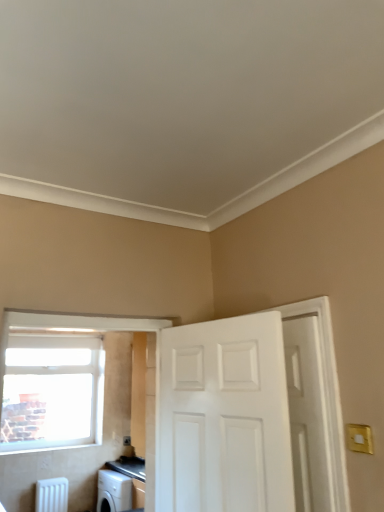
What do you see at coordinates (52, 391) in the screenshot?
I see `clear glass window at upper left` at bounding box center [52, 391].

Describe the element at coordinates (225, 417) in the screenshot. The height and width of the screenshot is (512, 384). I see `white glossy door at center, marked as the 1th door in a left-to-right arrangement` at that location.

Identify the location of white plastic radiator at lower left. The width and height of the screenshot is (384, 512). (52, 495).

Measure the distance between white plastic radiator at lower left and camera.

A distance of 4.09 meters exists between white plastic radiator at lower left and camera.

The image size is (384, 512). I want to click on clear glass window at upper left, so click(x=52, y=391).

What's the angular difference between white matte door at right, the 1th door in the right-to-left sequence, and white plastic radiator at lower left's facing directions?

There is a 93.2-degree angle between the facing directions of white matte door at right, the 1th door in the right-to-left sequence, and white plastic radiator at lower left.

In the scene shown: Between white matte door at right, the 1th door in the right-to-left sequence, and white plastic radiator at lower left, which one has smaller width?

With smaller width is white matte door at right, the 1th door in the right-to-left sequence.

Does point (301, 434) appear closer or farther from the camera than point (46, 480)?

Point (301, 434) appears to be closer to the viewer than point (46, 480).

Considering the relative positions of white glossy door at center, the second door in the right-to-left sequence, and white plastic radiator at lower left in the image provided, is white glossy door at center, the second door in the right-to-left sequence, behind white plastic radiator at lower left?

No, the depth of white glossy door at center, the second door in the right-to-left sequence, is less than that of white plastic radiator at lower left.

Considering the relative sizes of white glossy door at center, the second door in the right-to-left sequence, and white plastic radiator at lower left in the image provided, is white glossy door at center, the second door in the right-to-left sequence, bigger than white plastic radiator at lower left?

Yes.

How different are the orientations of white glossy door at center, the second door in the right-to-left sequence, and white plastic radiator at lower left in degrees?

The angular difference between white glossy door at center, the second door in the right-to-left sequence, and white plastic radiator at lower left is 83.7 degrees.

From the image's perspective, between white glossy door at center, marked as the 1th door in a left-to-right arrangement, and white plastic radiator at lower left, who is located below?

white plastic radiator at lower left is shown below in the image.

How far apart are white matte door at right, placed as the second door when sorted from left to right, and white glossy door at center, marked as the 1th door in a left-to-right arrangement?

white matte door at right, placed as the second door when sorted from left to right, is 11.56 inches from white glossy door at center, marked as the 1th door in a left-to-right arrangement.

From a real-world perspective, is white matte door at right, placed as the second door when sorted from left to right, over white glossy door at center, marked as the 1th door in a left-to-right arrangement?

Yes, from a real-world perspective, white matte door at right, placed as the second door when sorted from left to right, is over white glossy door at center, marked as the 1th door in a left-to-right arrangement

Is white matte door at right, the 1th door in the right-to-left sequence, in contact with white glossy door at center, marked as the 1th door in a left-to-right arrangement?

No, white matte door at right, the 1th door in the right-to-left sequence, is not touching white glossy door at center, marked as the 1th door in a left-to-right arrangement.

Based on their sizes in the image, would you say white matte door at right, the 1th door in the right-to-left sequence, is bigger or smaller than white glossy door at center, the second door in the right-to-left sequence?

In the image, white matte door at right, the 1th door in the right-to-left sequence, appears to be smaller than white glossy door at center, the second door in the right-to-left sequence.

Does white plastic radiator at lower left appear on the right side of white glossy door at center, the second door in the right-to-left sequence?

No, white plastic radiator at lower left is not to the right of white glossy door at center, the second door in the right-to-left sequence.

Identify the location of radiator on the left of white glossy door at center, marked as the 1th door in a left-to-right arrangement. (52, 495).

Does white plastic radiator at lower left have a lesser width compared to white glossy door at center, the second door in the right-to-left sequence?

No.

In terms of height, does clear glass window at upper left look taller or shorter compared to white plastic radiator at lower left?

clear glass window at upper left is taller than white plastic radiator at lower left.

Could you tell me if clear glass window at upper left is facing white plastic radiator at lower left?

No, clear glass window at upper left is not facing towards white plastic radiator at lower left.

You are a GUI agent. You are given a task and a screenshot of the screen. Output one action in this format:
    pyautogui.click(x=<x>, y=<y>)
    Task: Click on the radiator that is below the clear glass window at upper left (from the image's perspective)
    This screenshot has height=512, width=384.
    Given the screenshot: What is the action you would take?
    pyautogui.click(x=52, y=495)

Consider the image. Does white plastic radiator at lower left lie behind clear glass window at upper left?

No, white plastic radiator at lower left is closer to the camera.

Is white plastic radiator at lower left spatially inside clear glass window at upper left, or outside of it?

white plastic radiator at lower left is located beyond the bounds of clear glass window at upper left.

How many degrees apart are the facing directions of white plastic radiator at lower left and clear glass window at upper left?

The angle between the facing direction of white plastic radiator at lower left and the facing direction of clear glass window at upper left is 2.54 degrees.

In the scene shown: Considering the relative sizes of white plastic radiator at lower left and clear glass window at upper left in the image provided, is white plastic radiator at lower left taller than clear glass window at upper left?

In fact, white plastic radiator at lower left may be shorter than clear glass window at upper left.

Is white matte door at right, the 1th door in the right-to-left sequence, at the back of clear glass window at upper left?

No, clear glass window at upper left is not facing away from white matte door at right, the 1th door in the right-to-left sequence.

How far apart are clear glass window at upper left and white matte door at right, placed as the second door when sorted from left to right?

clear glass window at upper left and white matte door at right, placed as the second door when sorted from left to right, are 2.78 meters apart from each other.

Considering the sizes of clear glass window at upper left and white matte door at right, the 1th door in the right-to-left sequence, in the image, is clear glass window at upper left wider or thinner than white matte door at right, the 1th door in the right-to-left sequence,?

clear glass window at upper left is thinner than white matte door at right, the 1th door in the right-to-left sequence.

From the image's perspective, which one is positioned lower, clear glass window at upper left or white matte door at right, placed as the second door when sorted from left to right?

clear glass window at upper left is shown below in the image.

From the image's perspective, count 2nd doors upward from the white plastic radiator at lower left and point to it. Please provide its 2D coordinates.

[(307, 414)]

Locate an element on the screen. The height and width of the screenshot is (512, 384). the 2nd door in front of the white plastic radiator at lower left, counting from the anchor's position is located at coordinates (225, 417).

From the picture: Looking at the image, which one is located closer to clear glass window at upper left, white glossy door at center, the second door in the right-to-left sequence, or white plastic radiator at lower left?

white plastic radiator at lower left.

Looking at the image, which one is located further to white matte door at right, placed as the second door when sorted from left to right, white plastic radiator at lower left or white glossy door at center, marked as the 1th door in a left-to-right arrangement?

The object further to white matte door at right, placed as the second door when sorted from left to right, is white plastic radiator at lower left.

When comparing their distances from clear glass window at upper left, does white matte door at right, the 1th door in the right-to-left sequence, or white plastic radiator at lower left seem further?

The object further to clear glass window at upper left is white matte door at right, the 1th door in the right-to-left sequence.

Considering their positions, is clear glass window at upper left positioned closer to white glossy door at center, marked as the 1th door in a left-to-right arrangement, than white plastic radiator at lower left?

clear glass window at upper left is closer to white glossy door at center, marked as the 1th door in a left-to-right arrangement.

Consider the image. Which object lies nearer to the anchor point white matte door at right, the 1th door in the right-to-left sequence, white glossy door at center, the second door in the right-to-left sequence, or clear glass window at upper left?

white glossy door at center, the second door in the right-to-left sequence.

Which object lies further to the anchor point white matte door at right, the 1th door in the right-to-left sequence, white glossy door at center, the second door in the right-to-left sequence, or white plastic radiator at lower left?

white plastic radiator at lower left is positioned further to the anchor white matte door at right, the 1th door in the right-to-left sequence.

Considering their positions, is white matte door at right, the 1th door in the right-to-left sequence, positioned further to white plastic radiator at lower left than clear glass window at upper left?

white matte door at right, the 1th door in the right-to-left sequence.

Estimate the real-world distances between objects in this image. Which object is closer to white plastic radiator at lower left, white matte door at right, placed as the second door when sorted from left to right, or white glossy door at center, marked as the 1th door in a left-to-right arrangement?

Based on the image, white glossy door at center, marked as the 1th door in a left-to-right arrangement, appears to be nearer to white plastic radiator at lower left.

I want to click on radiator positioned between white matte door at right, placed as the second door when sorted from left to right, and clear glass window at upper left from near to far, so click(52, 495).

Where is `radiator between white glossy door at center, the second door in the right-to-left sequence, and clear glass window at upper left, along the z-axis`? The width and height of the screenshot is (384, 512). radiator between white glossy door at center, the second door in the right-to-left sequence, and clear glass window at upper left, along the z-axis is located at coordinates (52, 495).

Identify the location of door positioned between white glossy door at center, the second door in the right-to-left sequence, and clear glass window at upper left from near to far. The width and height of the screenshot is (384, 512). (307, 414).

Identify the location of door between white glossy door at center, marked as the 1th door in a left-to-right arrangement, and white plastic radiator at lower left in the front-back direction. This screenshot has height=512, width=384. (307, 414).